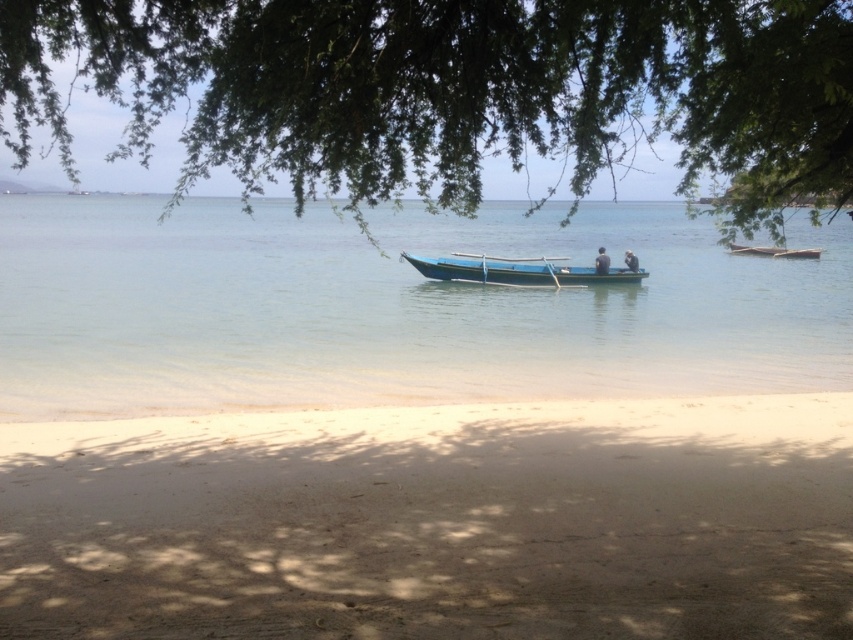
Question: Does green leafy tree at upper center appear over wooden canoe at center?

Choices:
 (A) no
 (B) yes

Answer: (B)

Question: Among these objects, which one is nearest to the camera?

Choices:
 (A) clear water at boat center
 (B) smooth skin person at center

Answer: (A)

Question: Can you confirm if clear water at boat center is wider than wooden canoe at center?

Choices:
 (A) yes
 (B) no

Answer: (A)

Question: Which point is closer to the camera?

Choices:
 (A) (207, 394)
 (B) (573, 269)
 (C) (625, 264)

Answer: (A)

Question: Among these points, which one is farthest from the camera?

Choices:
 (A) (631, 252)
 (B) (608, 266)
 (C) (728, 381)
 (D) (143, 45)

Answer: (A)

Question: Does clear water at boat center have a larger size compared to wooden canoe at center?

Choices:
 (A) yes
 (B) no

Answer: (A)